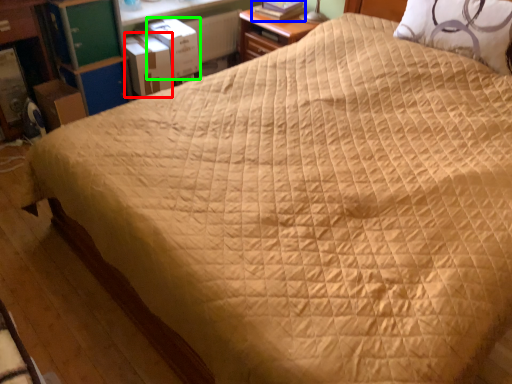
Question: Which object is the closest to the cardboard box (highlighted by a red box)? Choose among these: book (highlighted by a blue box) or cardboard box (highlighted by a green box).

Choices:
 (A) book
 (B) cardboard box

Answer: (B)